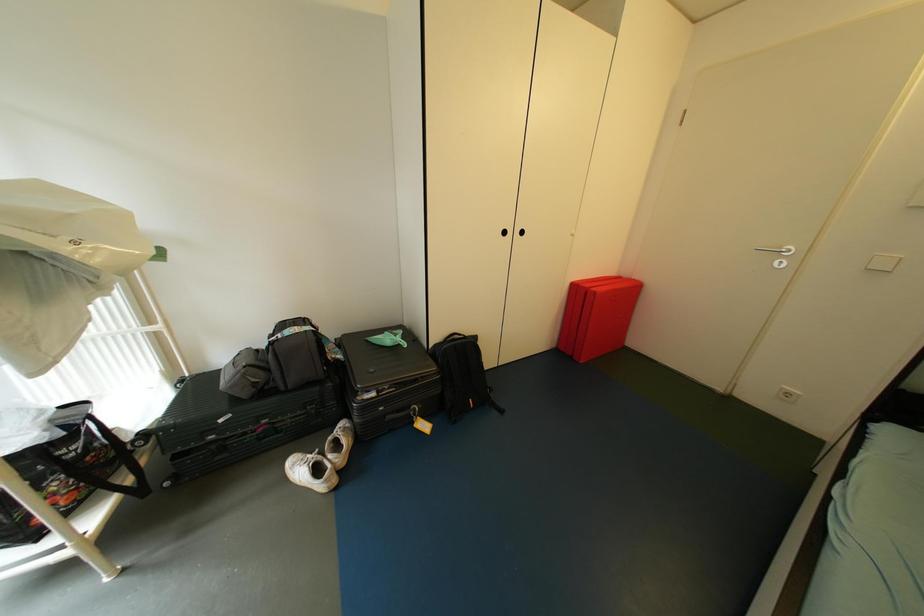
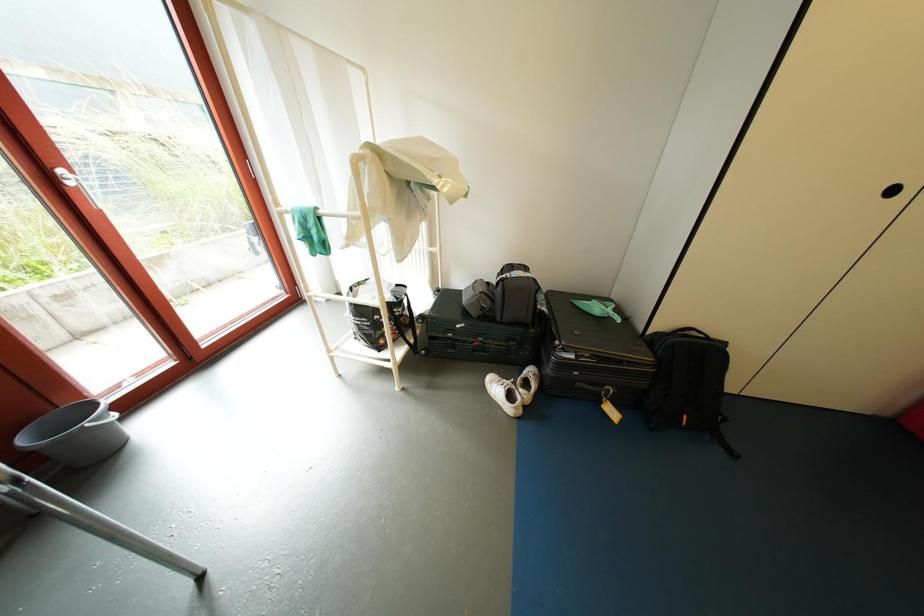
Question: The images are taken continuously from a first-person perspective. In which direction is your viewpoint rotating?

Choices:
 (A) Left
 (B) Right
 (C) Up
 (D) Down

Answer: (A)